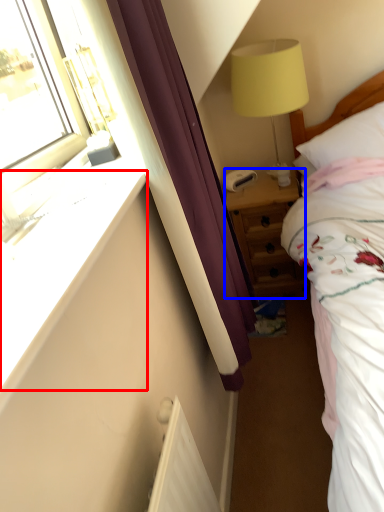
Question: Which point is further to the camera, window sill (highlighted by a red box) or nightstand (highlighted by a blue box)?

Choices:
 (A) window sill
 (B) nightstand

Answer: (B)